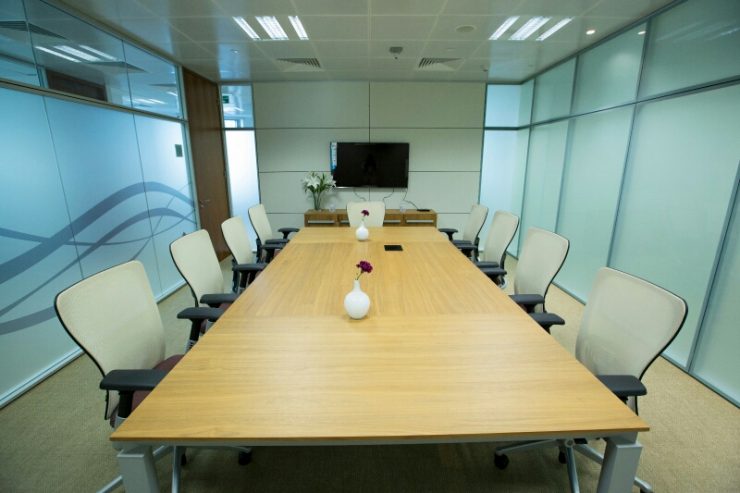
At what (x,y) coordinates should I click in order to perform the action: click on floor. Please return your answer as a coordinate pair (x, y). This screenshot has height=493, width=740. Looking at the image, I should click on (673, 428).